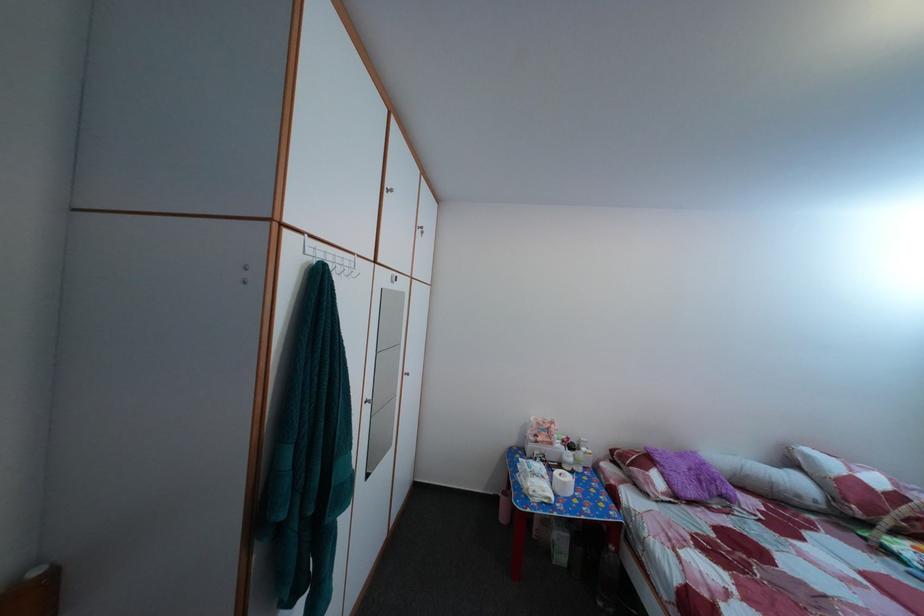
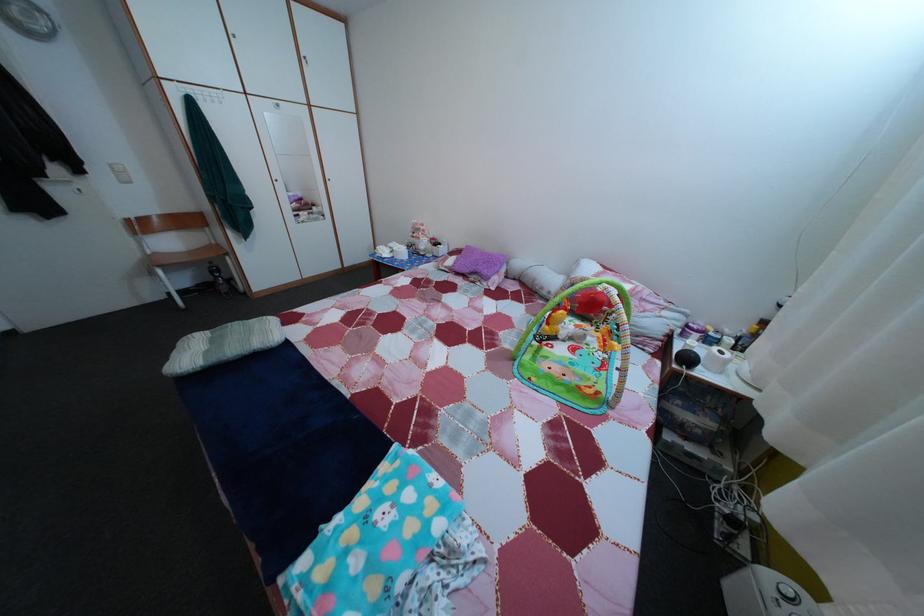
The point at (819, 511) is marked in the first image. Where is the corresponding point in the second image?

(553, 301)